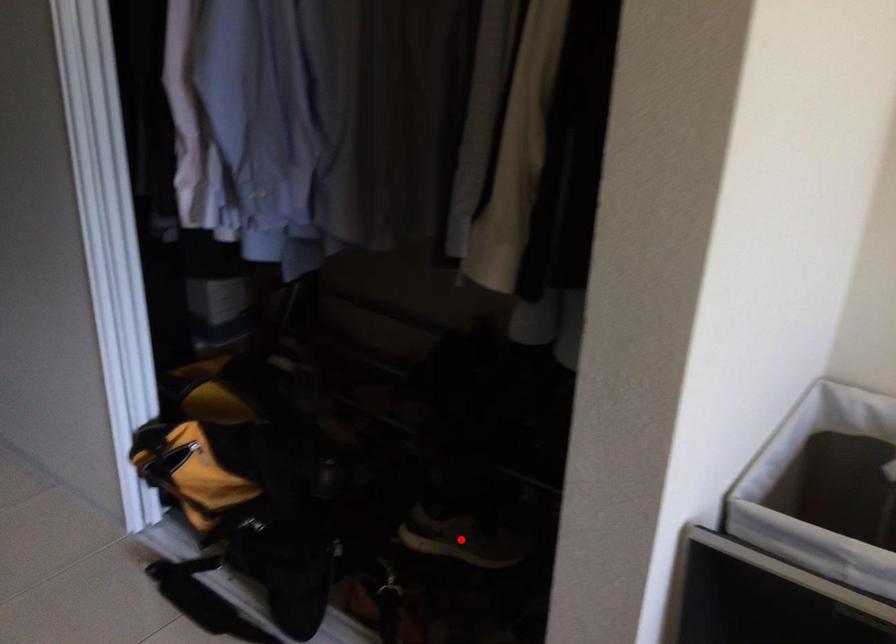
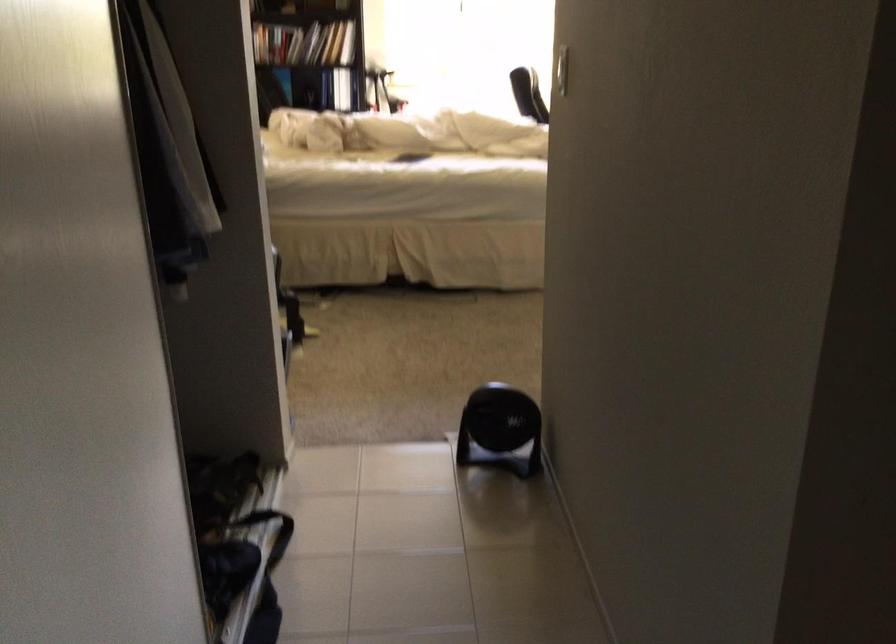
Question: I am providing you with two images of the same scene from different viewpoints. A red point is marked on the first image. Can you still see the location of the red point in image 2?

Choices:
 (A) Yes
 (B) No

Answer: (B)